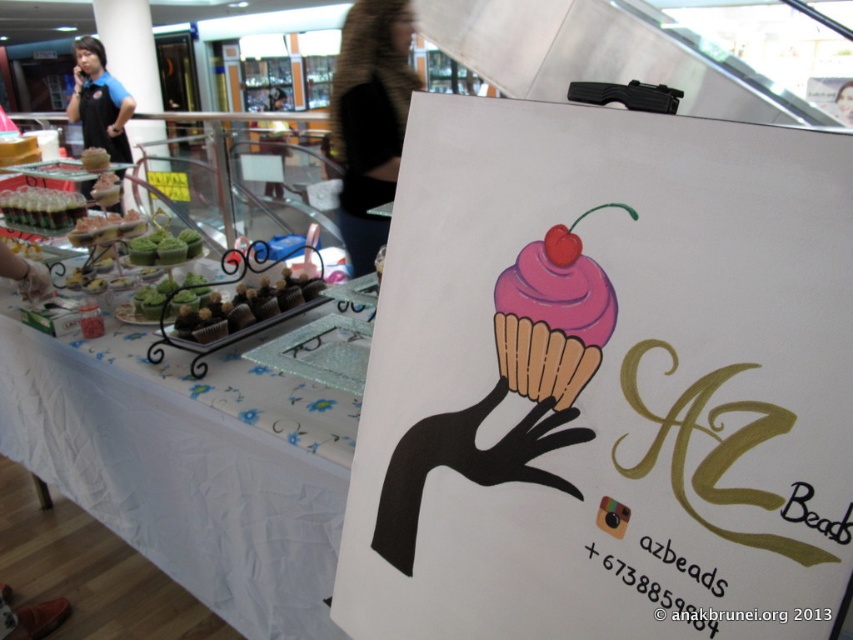
You are a customer standing at the entrance of the bakery stall and want to reach the pink matte cupcake at center. The path between you and the cupcake is blocked by the white fabric tablecloth at lower left. Can you walk around the tablecloth to get to the cupcake?

The distance between the white fabric tablecloth at lower left and the pink matte cupcake at center is 3.69 feet. Since the tablecloth is blocking the path, you would need to navigate around it. However, the given distance does not specify the tablecloth size, so it is unclear if there is enough space to walk around. Please check the actual space available.

You are a customer looking at the white fabric tablecloth at lower left and the pink matte cupcake at center. Which object is positioned more to the left side of the scene?

The white fabric tablecloth at lower left is positioned more to the left side of the scene compared to the pink matte cupcake at center.

You are a customer at the bakery stall and want to place an order. You see the white fabric tablecloth at lower left and the pink matte cupcake at center. Which object is taller?

The white fabric tablecloth at lower left is much taller than the pink matte cupcake at center.